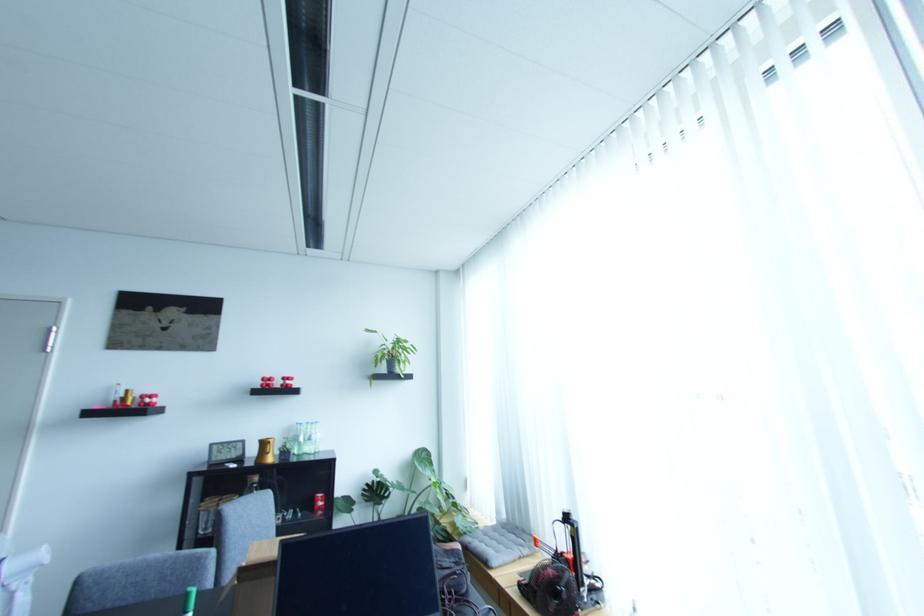
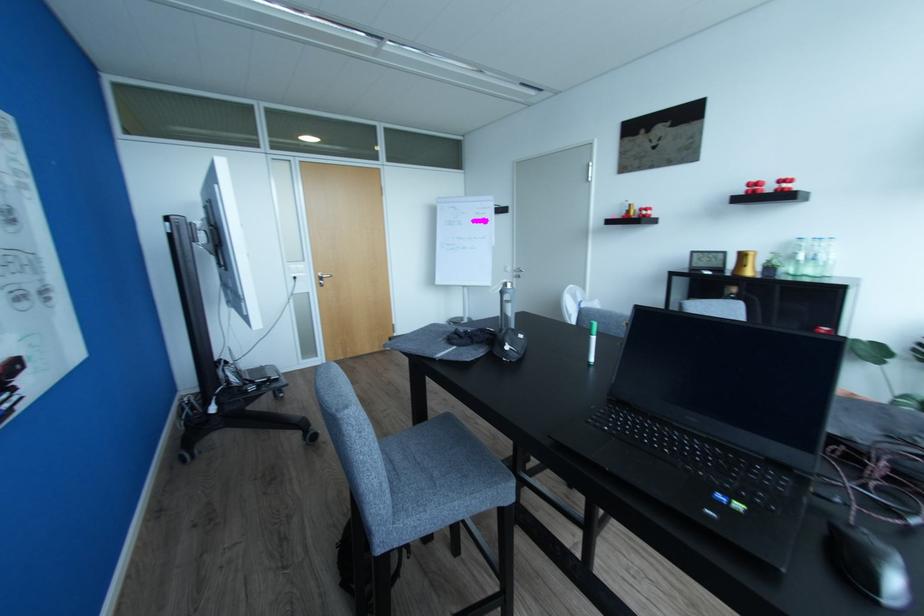
In the second image, find the point that corresponds to point 272,454 in the first image.

(750, 267)